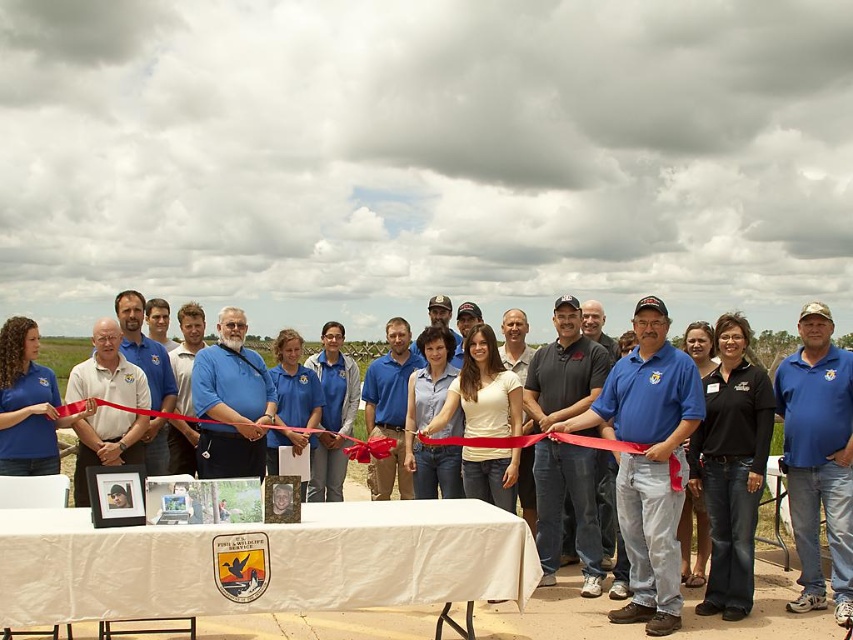
Question: Does white cloth-covered table at center have a greater width compared to matte blue shirt at center?

Choices:
 (A) no
 (B) yes

Answer: (B)

Question: Can you confirm if blue shirt at center is positioned above matte blue shirt at center?

Choices:
 (A) no
 (B) yes

Answer: (A)

Question: Does black denim jeans at lower right have a larger size compared to matte blue shirt at center?

Choices:
 (A) yes
 (B) no

Answer: (A)

Question: Which point is farther to the camera?

Choices:
 (A) white cloth-covered table at center
 (B) black denim jeans at lower right
 (C) blue shirt at center

Answer: (C)

Question: Estimate the real-world distances between objects in this image. Which object is closer to the blue cotton shirt at center?

Choices:
 (A) black denim jeans at lower right
 (B) white cloth-covered table at center

Answer: (A)

Question: Which point is farther from the camera taking this photo?

Choices:
 (A) (712, 460)
 (B) (537, 596)
 (C) (305, 484)
 (D) (840, 516)

Answer: (C)